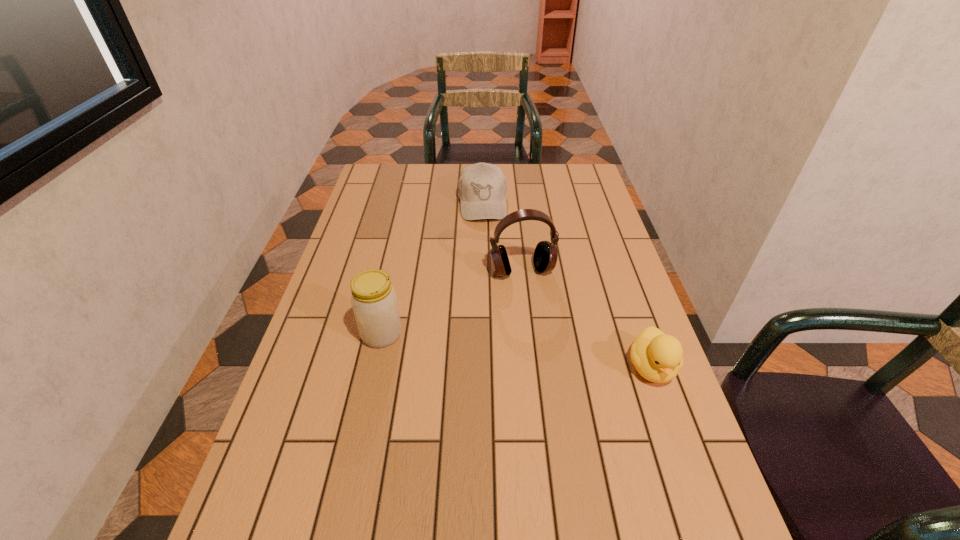
Image resolution: width=960 pixels, height=540 pixels. What are the coordinates of `free spot located on the front-facing side of the baseball cap` in the screenshot? It's located at (490, 300).

Find the location of a particular element. This screenshot has height=540, width=960. vacant space located on the front-facing side of the baseball cap is located at coordinates (489, 297).

You are a GUI agent. You are given a task and a screenshot of the screen. Output one action in this format:
    pyautogui.click(x=<x>, y=<y>)
    Task: Click on the object present at the far edge
    
    Given the screenshot: What is the action you would take?
    pyautogui.click(x=482, y=188)

Identify the location of object present at the left edge. (374, 301).

This screenshot has height=540, width=960. Find the location of `object that is at the right edge`. object that is at the right edge is located at coordinates (657, 357).

At what (x,y) coordinates should I click in order to perform the action: click on blank space at the far edge. Please return your answer as a coordinate pair (x, y). The image size is (960, 540). Looking at the image, I should click on (523, 194).

In order to click on vacant space at the near edge of the desktop in this screenshot , I will do `click(456, 512)`.

In the image, there is a desktop. At what (x,y) coordinates should I click in order to perform the action: click on blank space at the left edge. Please return your answer as a coordinate pair (x, y). This screenshot has width=960, height=540. Looking at the image, I should click on (351, 222).

Identify the location of free location at the right edge. Image resolution: width=960 pixels, height=540 pixels. (592, 195).

In the image, there is a desktop. At what (x,y) coordinates should I click in order to perform the action: click on vacant region at the near left corner. Please return your answer as a coordinate pair (x, y). The width and height of the screenshot is (960, 540). Looking at the image, I should click on (294, 513).